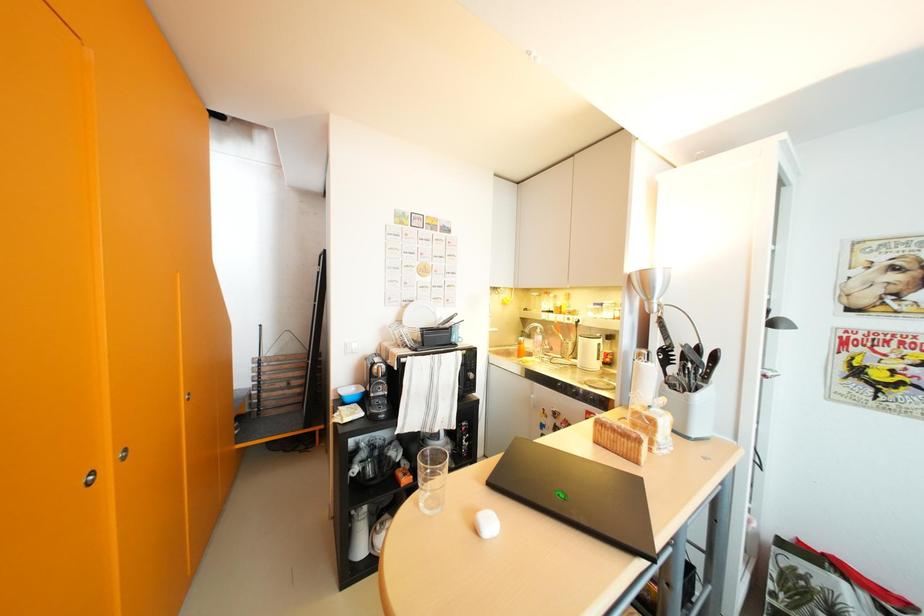
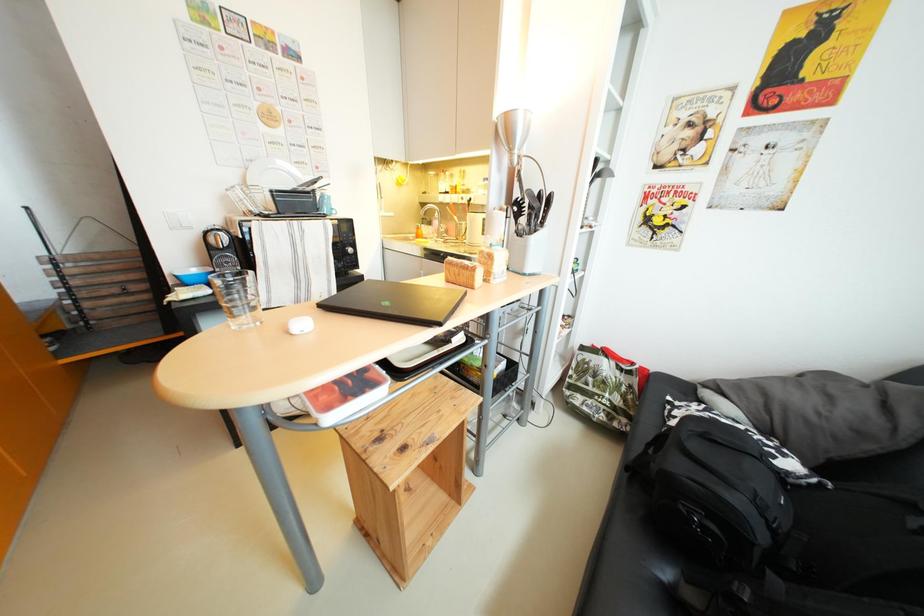
Question: In a continuous first-person perspective shot, in which direction is the camera moving?

Choices:
 (A) Left
 (B) Right
 (C) Forward
 (D) Backward

Answer: (B)